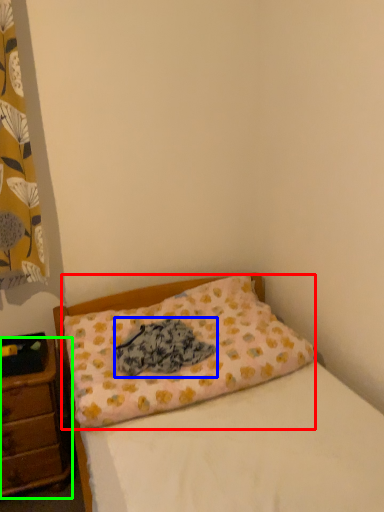
Question: Considering the real-world distances, which object is closest to pillow (highlighted by a red box)? material (highlighted by a blue box) or nightstand (highlighted by a green box).

Choices:
 (A) material
 (B) nightstand

Answer: (A)